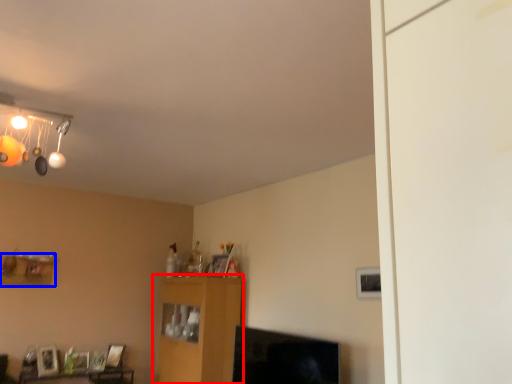
Question: Which object is closer to the camera taking this photo, furniture (highlighted by a red box) or shelf (highlighted by a blue box)?

Choices:
 (A) furniture
 (B) shelf

Answer: (A)